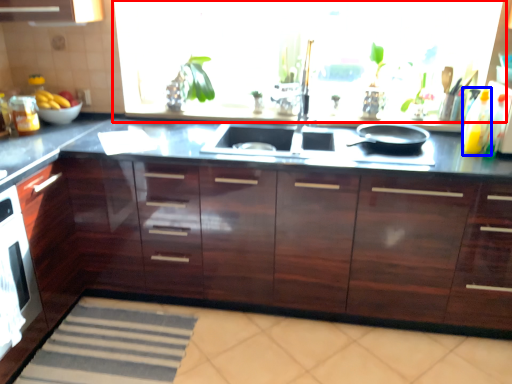
Question: Which of the following is the farthest to the observer, window screen (highlighted by a red box) or bottle (highlighted by a blue box)?

Choices:
 (A) window screen
 (B) bottle

Answer: (A)